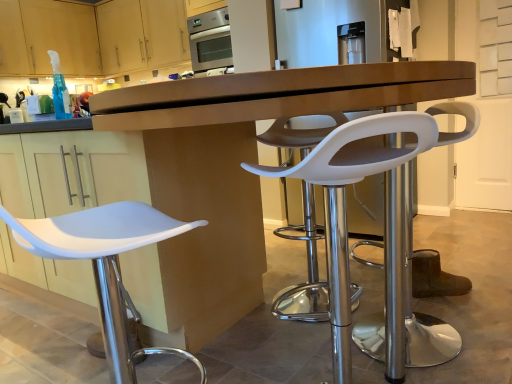
Image resolution: width=512 pixels, height=384 pixels. Find the location of `free space behind white plastic stool at center, marked as the 2th chair in a right-to-left arrangement`. free space behind white plastic stool at center, marked as the 2th chair in a right-to-left arrangement is located at coordinates (300, 360).